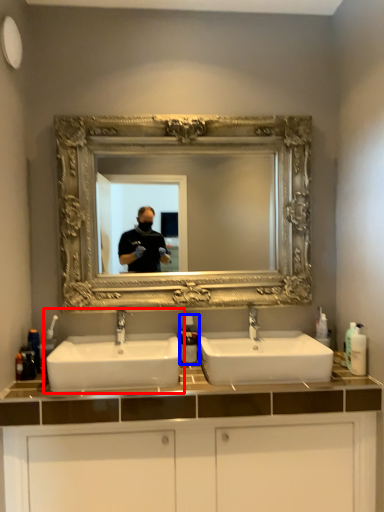
Question: Which object is further to the camera taking this photo, sink (highlighted by a red box) or soap dispenser (highlighted by a blue box)?

Choices:
 (A) sink
 (B) soap dispenser

Answer: (B)